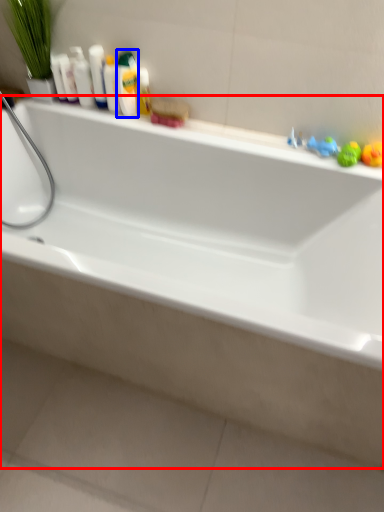
Question: Which object is closer to the camera taking this photo, bathtub (highlighted by a red box) or mouthwash (highlighted by a blue box)?

Choices:
 (A) bathtub
 (B) mouthwash

Answer: (A)